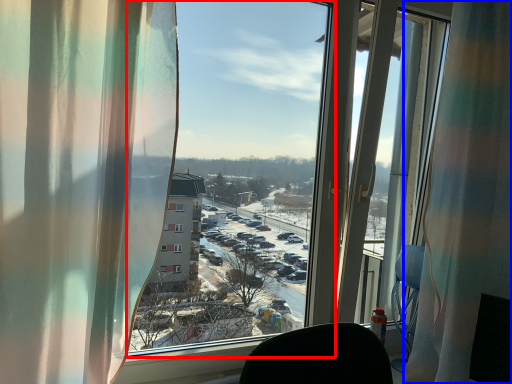
Question: Which object appears closest to the camera in this image, window screen (highlighted by a red box) or curtain (highlighted by a blue box)?

Choices:
 (A) window screen
 (B) curtain

Answer: (A)